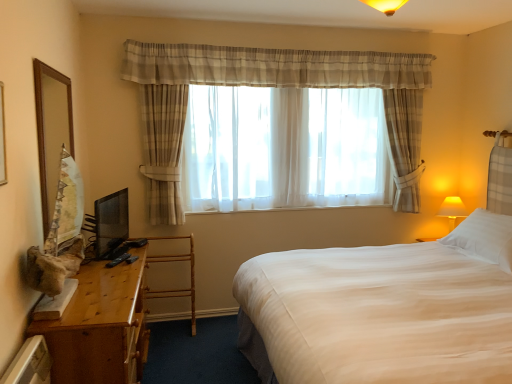
Find the location of `matte yellow plastic table lamp at right`. matte yellow plastic table lamp at right is located at coordinates (452, 210).

In order to face sheer fabric bay window at center, should I rotate leftwards or rightwards?

Turn right by 4.653 degrees to look at sheer fabric bay window at center.

This screenshot has height=384, width=512. Identify the location of matte yellow plastic table lamp at right. (452, 210).

From a real-world perspective, does white plastic radiator at lower left stand above wooden desk at left?

Yes, from a real-world perspective, white plastic radiator at lower left is above wooden desk at left.

Considering the sizes of white plastic radiator at lower left and wooden desk at left in the image, is white plastic radiator at lower left taller or shorter than wooden desk at left?

In the image, white plastic radiator at lower left appears to be shorter than wooden desk at left.

Is white plastic radiator at lower left positioned far away from wooden desk at left?

No, white plastic radiator at lower left is not far away from wooden desk at left.

Is wooden desk at left completely or partially inside white plastic radiator at lower left?

No, white plastic radiator at lower left does not contain wooden desk at left.

Is white soft pillow at upper right placed right next to sheer fabric bay window at center?

white soft pillow at upper right is not next to sheer fabric bay window at center, and they're not touching.

Is white soft pillow at upper right facing towards sheer fabric bay window at center?

No, white soft pillow at upper right does not turn towards sheer fabric bay window at center.

Relative to sheer fabric bay window at center, is white soft pillow at upper right in front or behind?

Visually, white soft pillow at upper right is located in front of sheer fabric bay window at center.

Does white soft pillow at upper right have a lesser height compared to sheer fabric bay window at center?

Correct, white soft pillow at upper right is not as tall as sheer fabric bay window at center.

Is wooden desk at left oriented away from sheer white curtain at center?

wooden desk at left is not turned away from sheer white curtain at center.

From a real-world perspective, is wooden desk at left physically above sheer white curtain at center?

Incorrect, from a real-world perspective, wooden desk at left is lower than sheer white curtain at center.

Considering the sizes of objects wooden desk at left and sheer white curtain at center in the image provided, who is bigger, wooden desk at left or sheer white curtain at center?

sheer white curtain at center is bigger.

The width and height of the screenshot is (512, 384). Identify the location of curtain above the wooden desk at left (from the image's perspective). (270, 86).

From the image's perspective, is white soft bed at center below white soft pillow at upper right?

Correct, white soft bed at center appears lower than white soft pillow at upper right in the image.

Considering the sizes of white soft bed at center and white soft pillow at upper right in the image, is white soft bed at center wider or thinner than white soft pillow at upper right?

In the image, white soft bed at center appears to be wider than white soft pillow at upper right.

From a real-world perspective, which is physically above, white soft bed at center or white soft pillow at upper right?

In real-world perspective, white soft pillow at upper right is above.

Looking at this image, is white soft bed at center further to camera compared to white soft pillow at upper right?

That is False.

Relative to sheer white curtain at center, is matte yellow plastic table lamp at right in front or behind?

matte yellow plastic table lamp at right is behind sheer white curtain at center.

Is point (445, 202) in front of point (413, 138)?

No, it is not.

At what (x,y) coordinates should I click in order to perform the action: click on curtain located above the matte yellow plastic table lamp at right (from a real-world perspective). Please return your answer as a coordinate pair (x, y). This screenshot has width=512, height=384. Looking at the image, I should click on (270, 86).

Which of these two, matte yellow plastic table lamp at right or sheer white curtain at center, is smaller?

matte yellow plastic table lamp at right is smaller.

The width and height of the screenshot is (512, 384). In order to click on table lamp above the bamboo rack at left (from a real-world perspective) in this screenshot , I will do `click(452, 210)`.

Is matte yellow plastic table lamp at right surrounding bamboo rack at left?

No, bamboo rack at left is not surrounded by matte yellow plastic table lamp at right.

In the scene shown: From a real-world perspective, is matte yellow plastic table lamp at right beneath bamboo rack at left?

No, from a real-world perspective, matte yellow plastic table lamp at right is not below bamboo rack at left.

Consider the image. Between matte yellow plastic table lamp at right and bamboo rack at left, which one has larger size?

Bigger between the two is bamboo rack at left.

Can you confirm if white plastic radiator at lower left is smaller than sheer white curtain at center?

Yes, white plastic radiator at lower left is smaller than sheer white curtain at center.

Can we say white plastic radiator at lower left lies outside sheer white curtain at center?

Yes, white plastic radiator at lower left is located beyond the bounds of sheer white curtain at center.

Could you tell me if white plastic radiator at lower left is turned towards sheer white curtain at center?

No, white plastic radiator at lower left is not turned towards sheer white curtain at center.

In the image, is white plastic radiator at lower left positioned in front of or behind sheer white curtain at center?

Visually, white plastic radiator at lower left is located in front of sheer white curtain at center.

I want to click on radiator on the right of wooden desk at left, so click(30, 364).

Where is `bay window located behind the white soft pillow at upper right`? bay window located behind the white soft pillow at upper right is located at coordinates (285, 149).

Which object lies nearer to the anchor point matte yellow plastic table lamp at right, sheer white curtain at center or white plastic radiator at lower left?

Among the two, sheer white curtain at center is located nearer to matte yellow plastic table lamp at right.

Based on the photo, considering their positions, is white soft bed at center positioned closer to bamboo rack at left than white plastic radiator at lower left?

white soft bed at center is positioned closer to the anchor bamboo rack at left.

When comparing their distances from sheer white curtain at center, does white soft pillow at upper right or white soft bed at center seem further?

white soft bed at center is further to sheer white curtain at center.

Which object lies nearer to the anchor point matte yellow plastic table lamp at right, sheer fabric bay window at center or bamboo rack at left?

The object closer to matte yellow plastic table lamp at right is sheer fabric bay window at center.

Considering their positions, is white plastic radiator at lower left positioned further to sheer white curtain at center than wooden desk at left?

white plastic radiator at lower left is further to sheer white curtain at center.

Based on their spatial positions, is matte yellow plastic table lamp at right or wooden desk at left further from white soft pillow at upper right?

Among the two, wooden desk at left is located further to white soft pillow at upper right.

Considering their positions, is wooden desk at left positioned further to bamboo rack at left than white plastic radiator at lower left?

white plastic radiator at lower left is positioned further to the anchor bamboo rack at left.

Considering their positions, is white soft bed at center positioned closer to sheer white curtain at center than bamboo rack at left?

bamboo rack at left lies closer to sheer white curtain at center than the other object.

You are a GUI agent. You are given a task and a screenshot of the screen. Output one action in this format:
    pyautogui.click(x=<x>, y=<y>)
    Task: Click on the bay window between sheer white curtain at center and bamboo rack at left in the up-down direction
    The image size is (512, 384).
    Given the screenshot: What is the action you would take?
    pyautogui.click(x=285, y=149)

At what (x,y) coordinates should I click in order to perform the action: click on table between white soft bed at center and sheer fabric bay window at center from front to back. Please return your answer as a coordinate pair (x, y). Looking at the image, I should click on (100, 327).

You are a GUI agent. You are given a task and a screenshot of the screen. Output one action in this format:
    pyautogui.click(x=<x>, y=<y>)
    Task: Click on the armchair between white plastic radiator at lower left and matte yellow plastic table lamp at right
    This screenshot has width=512, height=384.
    Given the screenshot: What is the action you would take?
    pyautogui.click(x=175, y=289)

Identify the location of bay window between wooden desk at left and white soft pillow at upper right from left to right. (285, 149).